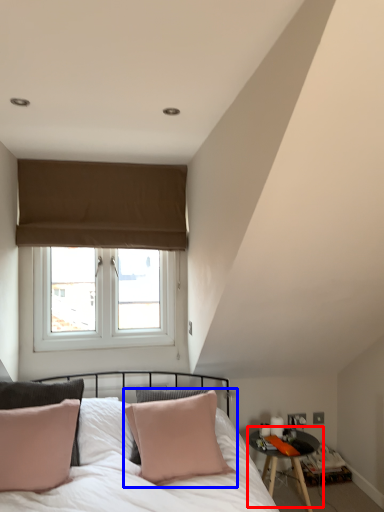
Question: Which object is closer to the camera taking this photo, table (highlighted by a red box) or pillow (highlighted by a blue box)?

Choices:
 (A) table
 (B) pillow

Answer: (B)